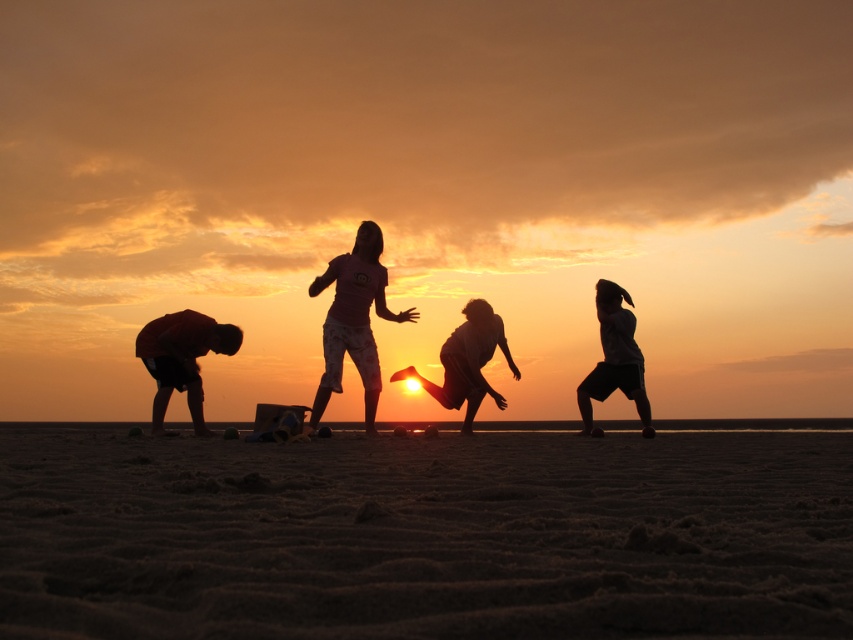
Question: Is pink fabric shorts at center behind silhouette figure at right?

Choices:
 (A) no
 (B) yes

Answer: (A)

Question: Does dark red fabric shorts at lower left appear on the right side of silhouette figure at right?

Choices:
 (A) yes
 (B) no

Answer: (B)

Question: Among these points, which one is nearest to the camera?

Choices:
 (A) (231, 456)
 (B) (589, 419)

Answer: (A)

Question: Among these objects, which one is nearest to the camera?

Choices:
 (A) pink fabric shorts at center
 (B) dark red fabric shorts at lower left

Answer: (B)

Question: Which object is closer to the camera taking this photo?

Choices:
 (A) brown sandy beach at lower center
 (B) pink fabric shorts at center
 (C) dark red fabric shorts at lower left

Answer: (A)

Question: Is dark red fabric shorts at lower left behind silhouette child at center?

Choices:
 (A) no
 (B) yes

Answer: (A)